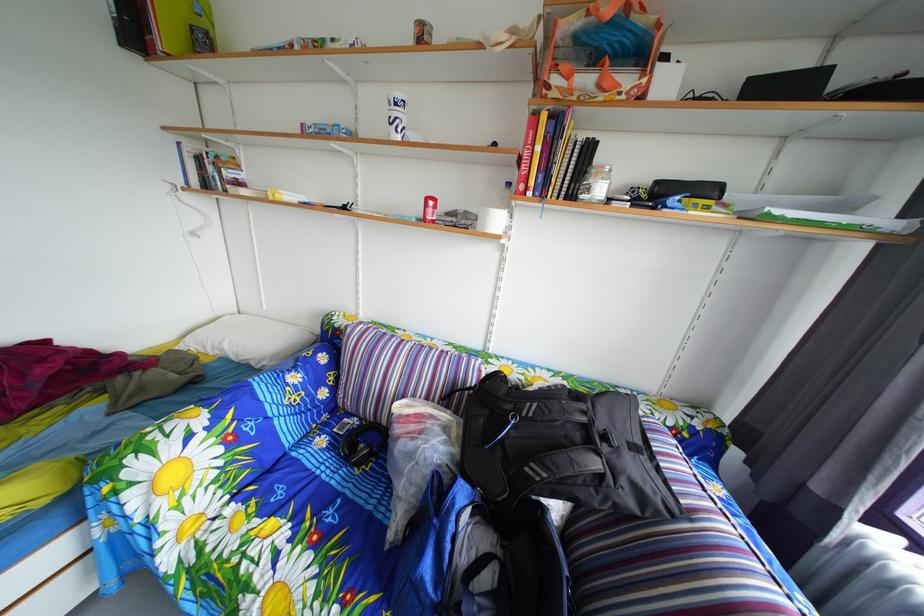
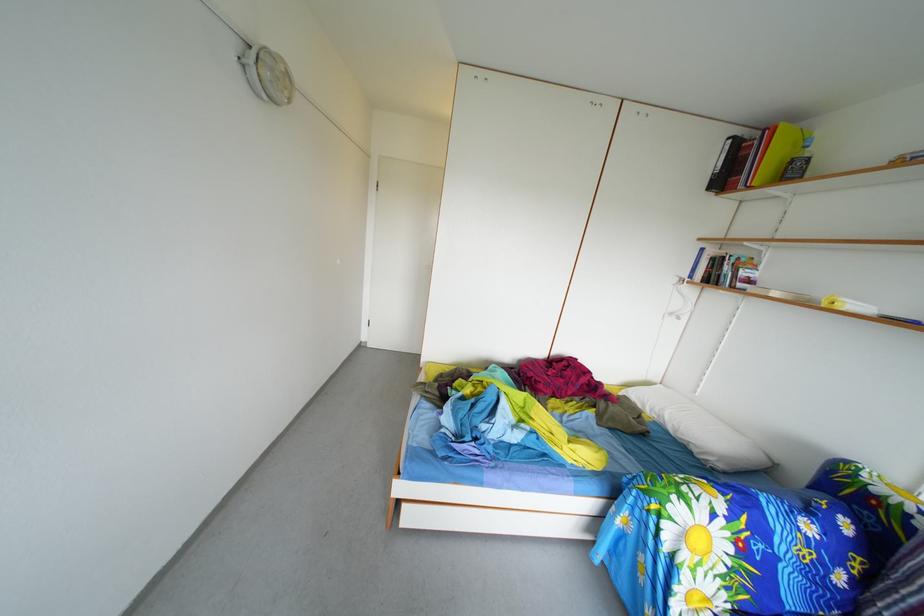
Question: The first image is from the beginning of the video and the second image is from the end. How did the camera likely rotate when shooting the video?

Choices:
 (A) Left
 (B) Right
 (C) Up
 (D) Down

Answer: (A)